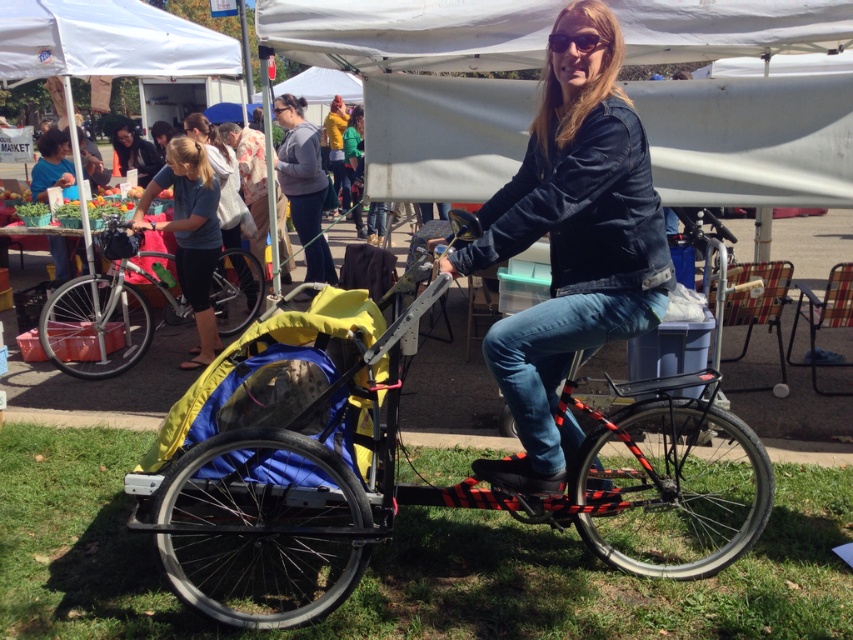
You are standing at the market entrance and see the blue fabric bag at center. If you want to reach it quickly, should you walk straight ahead or turn left?

The blue fabric bag at center is 19.54 feet away from viewer, so walking straight ahead would be the fastest route to reach it.

You are standing at the point marked as point (433, 490) in the image. What object is located exactly at this point?

The black plastic tricycle at center is located exactly at point (433, 490).